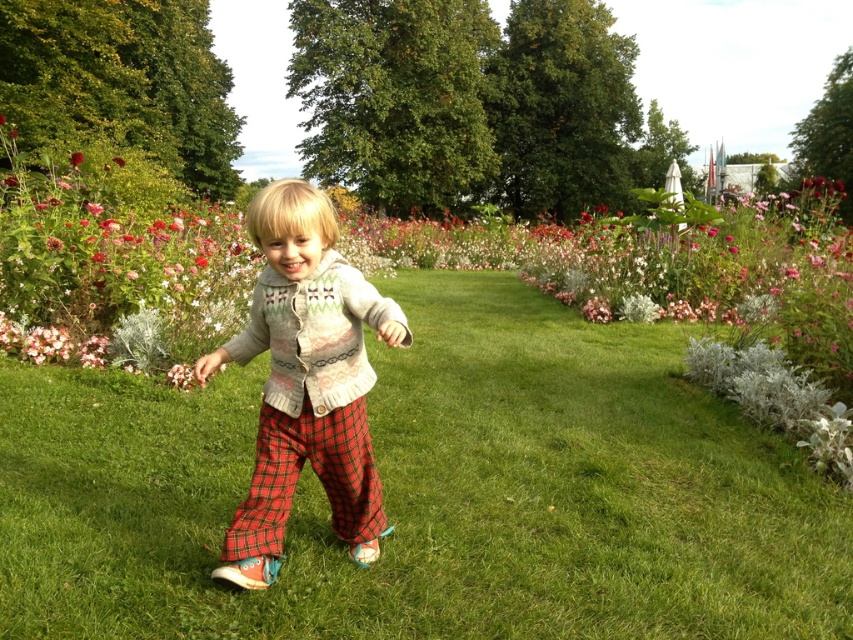
Is knitted sweater at center positioned in front of red plaid pants at center?

Yes, it is.

Between knitted sweater at center and red plaid pants at center, which one has more height?

With more height is knitted sweater at center.

Is point (276, 205) positioned before point (265, 444)?

Yes, it is.

At what (x,y) coordinates should I click in order to perform the action: click on knitted sweater at center. Please return your answer as a coordinate pair (x, y). Looking at the image, I should click on (306, 381).

Who is higher up, knitted sweater at center or smooth red flower at center?

smooth red flower at center

Is knitted sweater at center bigger than smooth red flower at center?

Actually, knitted sweater at center might be smaller than smooth red flower at center.

The image size is (853, 640). Describe the element at coordinates (306, 381) in the screenshot. I see `knitted sweater at center` at that location.

This screenshot has height=640, width=853. Identify the location of knitted sweater at center. 306,381.

Where is `smooth red flower at center`? The height and width of the screenshot is (640, 853). smooth red flower at center is located at coordinates click(x=74, y=157).

Is point (74, 163) in front of point (119, 156)?

Yes, point (74, 163) is in front of point (119, 156).

Is point (76, 164) closer to camera compared to point (115, 163)?

Yes, point (76, 164) is in front of point (115, 163).

In order to click on smooth red flower at center in this screenshot , I will do `click(74, 157)`.